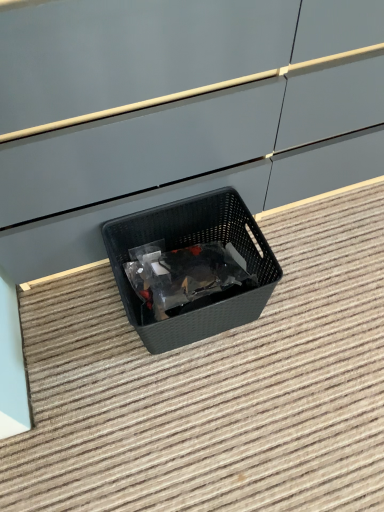
Question: In terms of height, does black plastic basket at center look taller or shorter compared to black plastic basket at center?

Choices:
 (A) tall
 (B) short

Answer: (A)

Question: From a real-world perspective, is black plastic basket at center physically located above or below black plastic basket at center?

Choices:
 (A) above
 (B) below

Answer: (A)

Question: From the image's perspective, is black plastic basket at center located above or below black plastic basket at center?

Choices:
 (A) below
 (B) above

Answer: (B)

Question: In terms of height, does black plastic basket at center look taller or shorter compared to black plastic basket at center?

Choices:
 (A) tall
 (B) short

Answer: (B)

Question: From a real-world perspective, is black plastic basket at center above or below black plastic basket at center?

Choices:
 (A) below
 (B) above

Answer: (A)

Question: Which is correct: black plastic basket at center is inside black plastic basket at center, or outside of it?

Choices:
 (A) inside
 (B) outside

Answer: (B)

Question: In the image, is black plastic basket at center on the left side or the right side of black plastic basket at center?

Choices:
 (A) left
 (B) right

Answer: (B)